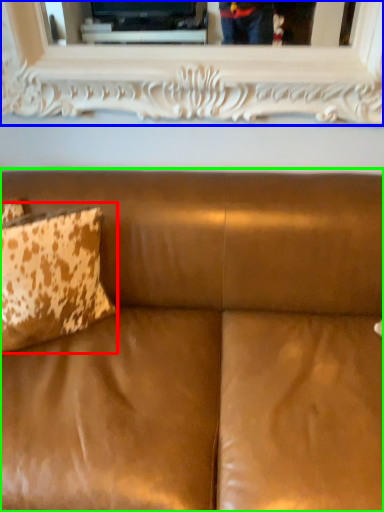
Question: Based on their relative distances, which object is nearer to pillow (highlighted by a red box)? Choose from picture frame (highlighted by a blue box) and studio couch (highlighted by a green box).

Choices:
 (A) picture frame
 (B) studio couch

Answer: (B)